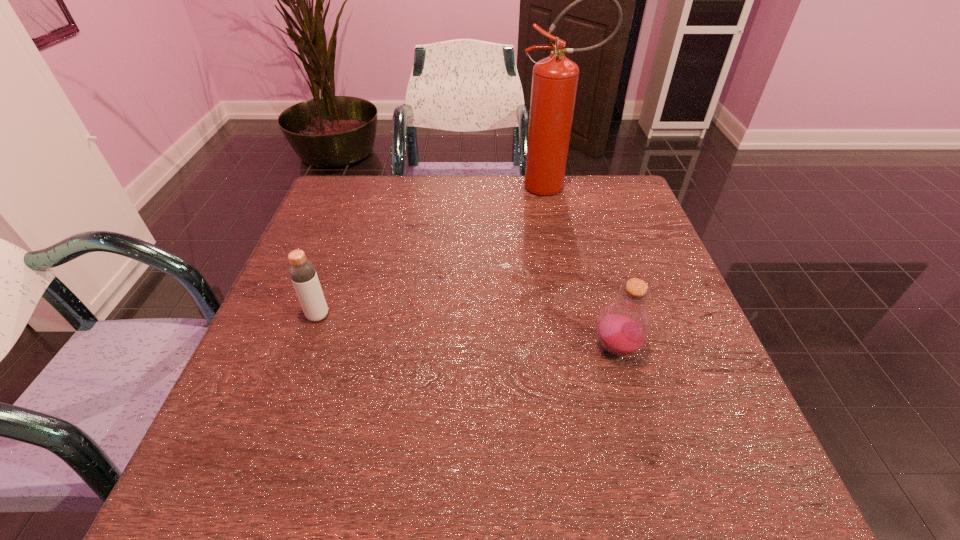
The height and width of the screenshot is (540, 960). Find the location of `fire extinguisher`. fire extinguisher is located at coordinates (555, 78).

Identify the location of the farthest object. (555, 78).

Find the location of a particular element. This screenshot has height=540, width=960. the nearer bottle is located at coordinates (624, 326).

Locate an element on the screen. The height and width of the screenshot is (540, 960). the right bottle is located at coordinates (624, 326).

Where is `the second farthest object`? the second farthest object is located at coordinates (302, 272).

Locate an element on the screen. the farther bottle is located at coordinates (302, 272).

This screenshot has height=540, width=960. What are the coordinates of `free space located from the nozzle of the fire extinguisher` in the screenshot? It's located at (413, 187).

Where is `free space located 0.370m from the nozzle of the fire extinguisher`? This screenshot has height=540, width=960. free space located 0.370m from the nozzle of the fire extinguisher is located at coordinates (393, 187).

What are the coordinates of `free space located 0.160m from the nozzle of the fire extinguisher` in the screenshot? It's located at (463, 187).

The width and height of the screenshot is (960, 540). Identify the location of vacant area located on the back of the nearest object. (585, 234).